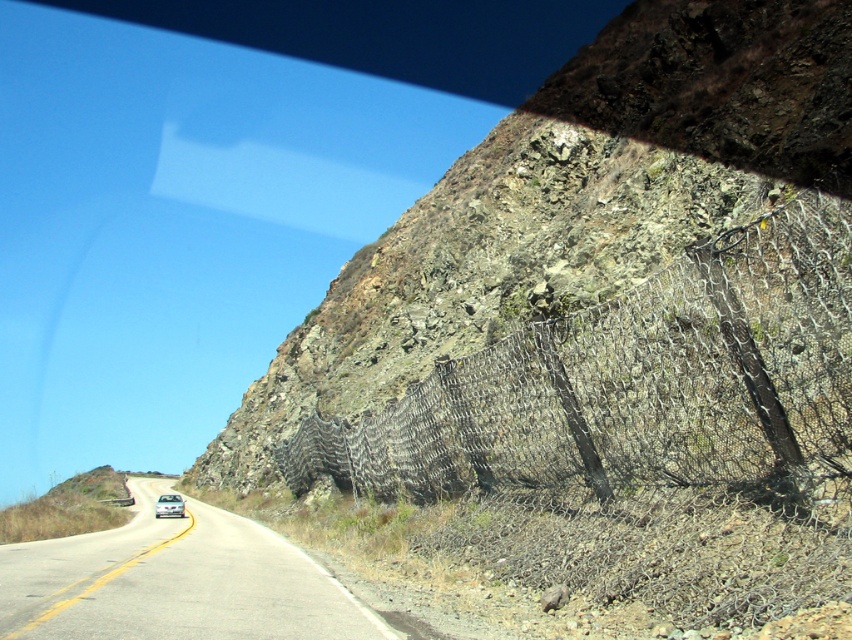
Is rugged stone mountain at center to the left of white asphalt road at center from the viewer's perspective?

No, rugged stone mountain at center is not to the left of white asphalt road at center.

Which is below, rugged stone mountain at center or white asphalt road at center?

white asphalt road at center is lower down.

Image resolution: width=852 pixels, height=640 pixels. What do you see at coordinates (567, 204) in the screenshot?
I see `rugged stone mountain at center` at bounding box center [567, 204].

Locate an element on the screen. This screenshot has height=640, width=852. rugged stone mountain at center is located at coordinates (567, 204).

Which is behind, point (819, 198) or point (165, 496)?

The point (165, 496) is more distant.

Does rusty wire mesh fence at upper right appear on the left side of white glossy car at center?

Incorrect, rusty wire mesh fence at upper right is not on the left side of white glossy car at center.

What do you see at coordinates (643, 429) in the screenshot? I see `rusty wire mesh fence at upper right` at bounding box center [643, 429].

This screenshot has height=640, width=852. Identify the location of rusty wire mesh fence at upper right. (643, 429).

Is point (456, 406) positioned behind point (623, 269)?

That is False.

Looking at this image, who is higher up, rusty wire mesh fence at upper right or rugged stone mountain at center?

rugged stone mountain at center is higher up.

Between point (747, 273) and point (517, 136), which one is positioned behind?

Point (517, 136)

I want to click on rusty wire mesh fence at upper right, so click(x=643, y=429).